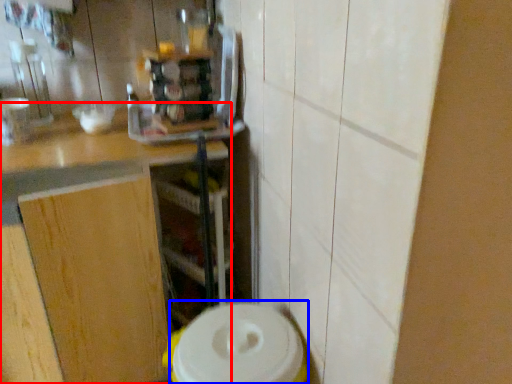
Question: Which object is further to the camera taking this photo, countertop (highlighted by a red box) or appliance (highlighted by a blue box)?

Choices:
 (A) countertop
 (B) appliance

Answer: (A)